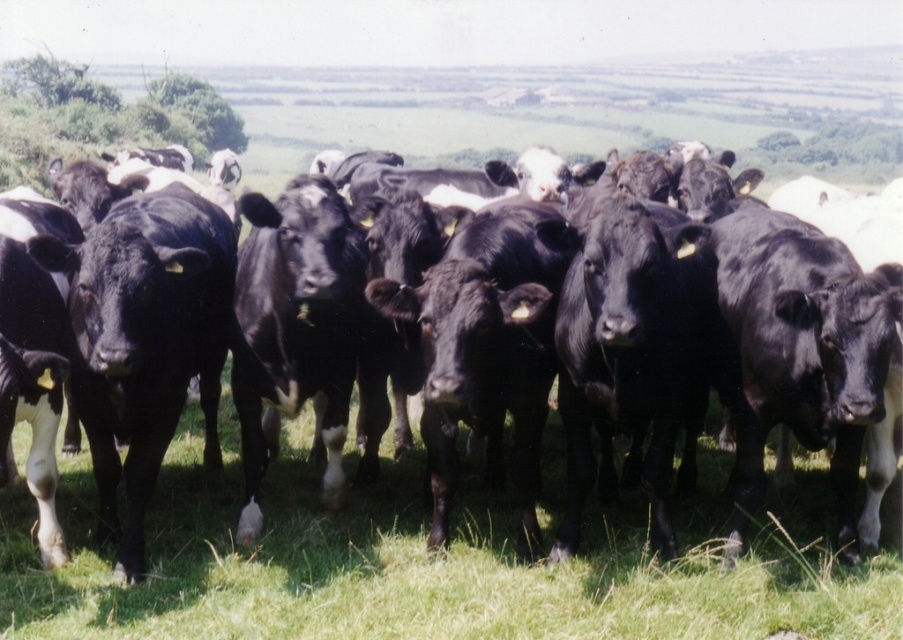
Question: Is black glossy cows at center above green grass at center?

Choices:
 (A) no
 (B) yes

Answer: (B)

Question: From the image, what is the correct spatial relationship of black glossy cows at center in relation to green grass at center?

Choices:
 (A) above
 (B) below

Answer: (A)

Question: Does black glossy cows at center have a lesser width compared to green grass at center?

Choices:
 (A) yes
 (B) no

Answer: (A)

Question: Which of the following is the closest to the observer?

Choices:
 (A) pyautogui.click(x=858, y=577)
 (B) pyautogui.click(x=691, y=401)

Answer: (A)